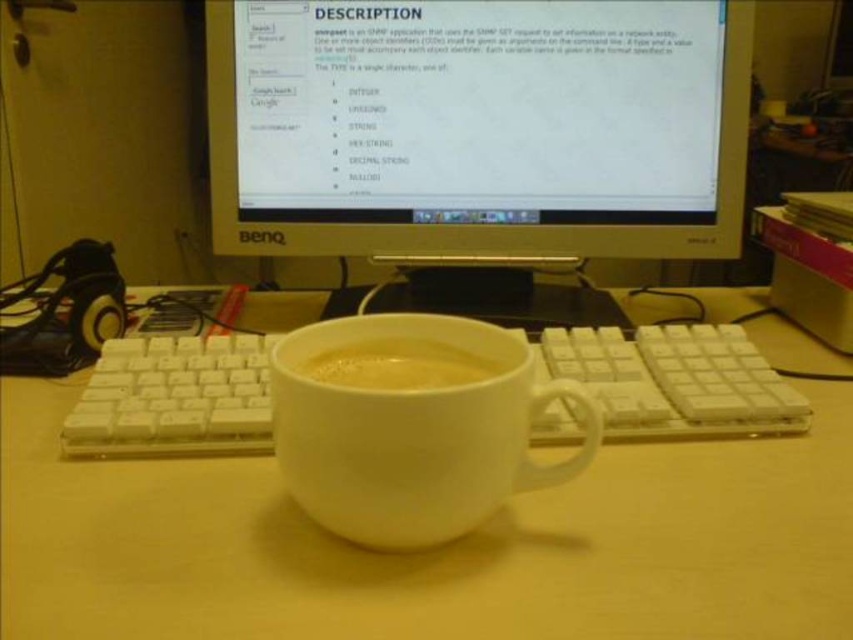
You are setting up a desk for a client who prefers items arranged by height, with taller items to the left. Given the white matte mug at center and the white matte cup at center, which should be placed on the left side?

The white matte mug at center is taller than the white matte cup at center, so it should be placed on the left side as per the client preference.

You are looking at the workspace setup. There are two points marked on the desk surface, one at coordinates point [405,433] and another at point [485,380]. Which point is closer to you?

Point [405,433] is closer to the viewer than point [485,380].

You are organizing items on your desk and need to place both the white matte mug at center and the white matte cup at center. According to the image, which item is located directly below the other?

The white matte mug at center is positioned under the white matte cup at center, so the mug is directly below the cup.